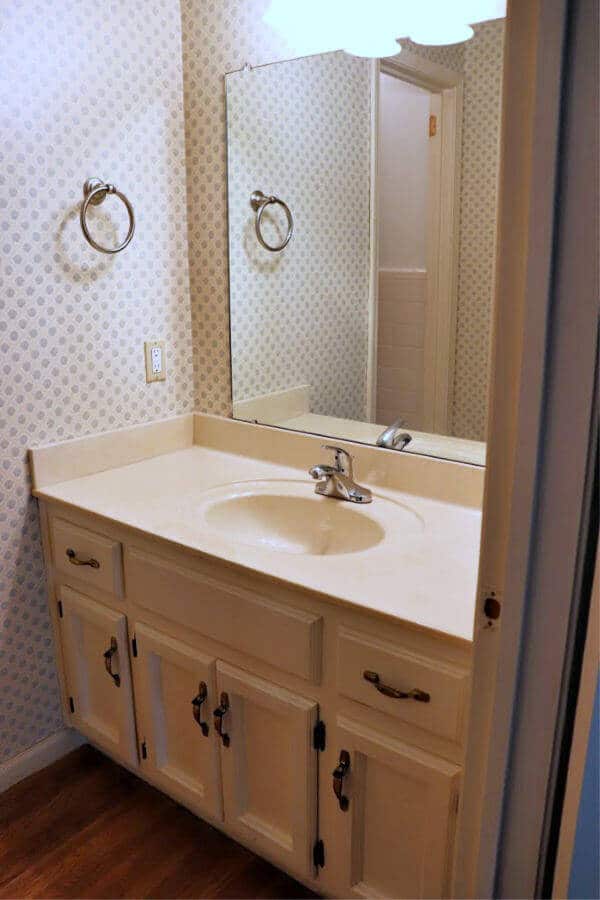
The width and height of the screenshot is (600, 900). I want to click on sink, so click(303, 542).